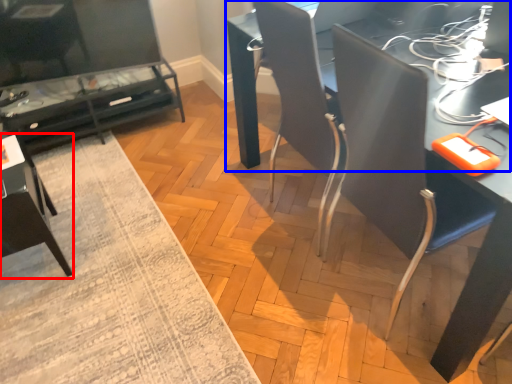
Question: Which object appears farthest to the camera in this image, armchair (highlighted by a red box) or table (highlighted by a blue box)?

Choices:
 (A) armchair
 (B) table

Answer: (A)